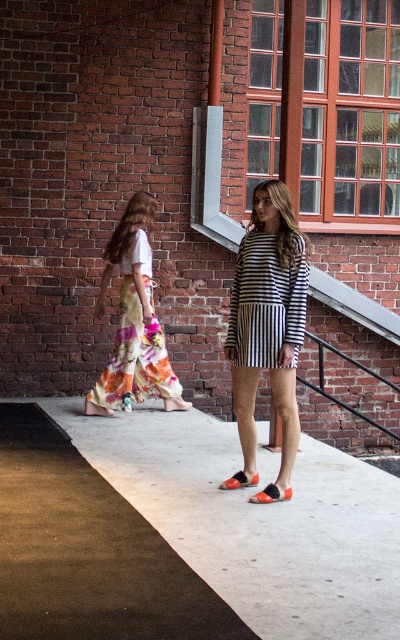
Is concrete sidewalk at center bigger than floral cotton skirt at left?

Yes, concrete sidewalk at center is bigger than floral cotton skirt at left.

What do you see at coordinates (182, 536) in the screenshot? I see `concrete sidewalk at center` at bounding box center [182, 536].

Does point (175, 460) lie behind point (124, 317)?

That is False.

Locate an element on the screen. concrete sidewalk at center is located at coordinates (182, 536).

Between matte orange sandal at lower center and orange leather sandal at lower center, which one has more height?

matte orange sandal at lower center

Which is above, matte orange sandal at lower center or orange leather sandal at lower center?

orange leather sandal at lower center is above.

At what (x,y) coordinates should I click in order to perform the action: click on matte orange sandal at lower center. Please return your answer as a coordinate pair (x, y). Looking at the image, I should click on (270, 493).

Does floral cotton skirt at left appear over matte orange sandal at lower center?

Yes, floral cotton skirt at left is above matte orange sandal at lower center.

Is floral cotton skirt at left in front of matte orange sandal at lower center?

No.

The height and width of the screenshot is (640, 400). Identify the location of floral cotton skirt at left. (136, 342).